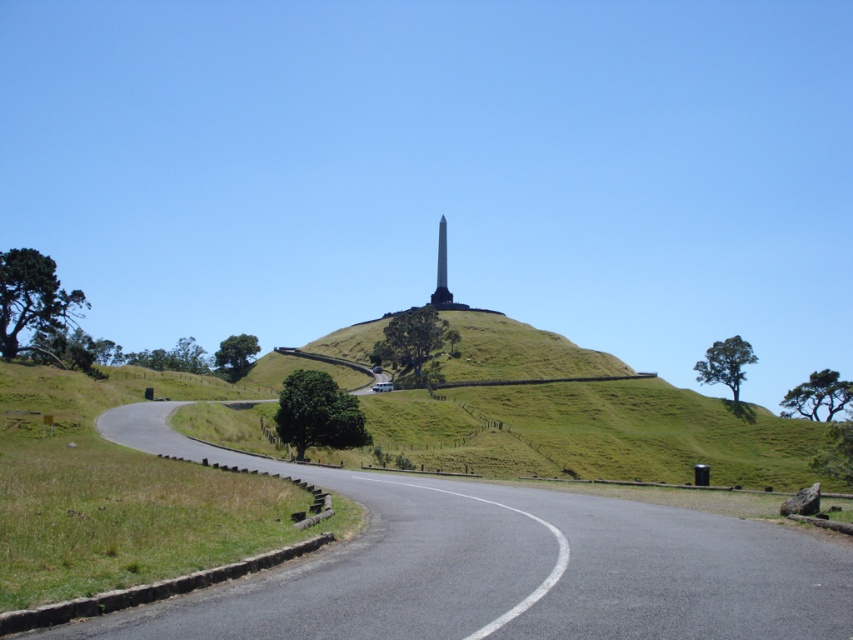
You are a landscape architect designing a new pathway. You need to ensure the green grass at lower left and the black polished obelisk at center are visible from the main entrance. Given their sizes, which object would appear larger when viewed from the entrance?

The black polished obelisk at center appears larger than the green grass at lower left because it is physically larger, as stated in the description.